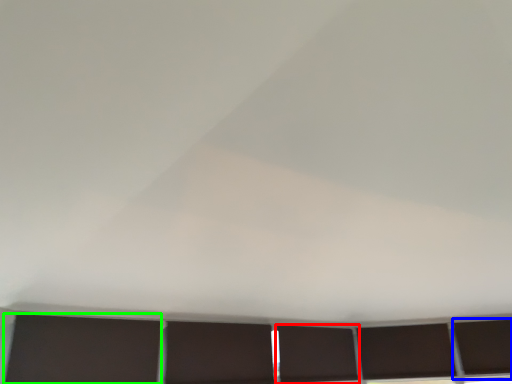
Question: Which object is the closest to the window (highlighted by a red box)? Choose among these: window (highlighted by a blue box) or shutter (highlighted by a green box).

Choices:
 (A) window
 (B) shutter

Answer: (A)